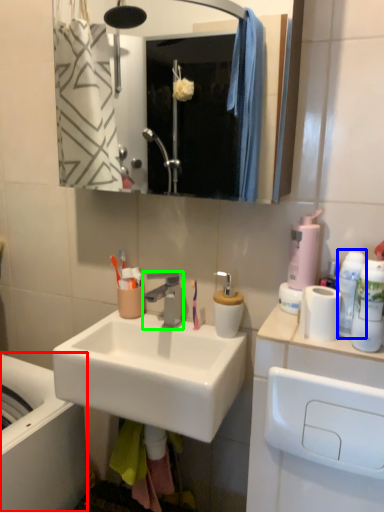
Question: Which object is the farthest from bath (highlighted by a red box)? Choose among these: mouthwash (highlighted by a blue box) or tap (highlighted by a green box).

Choices:
 (A) mouthwash
 (B) tap

Answer: (A)